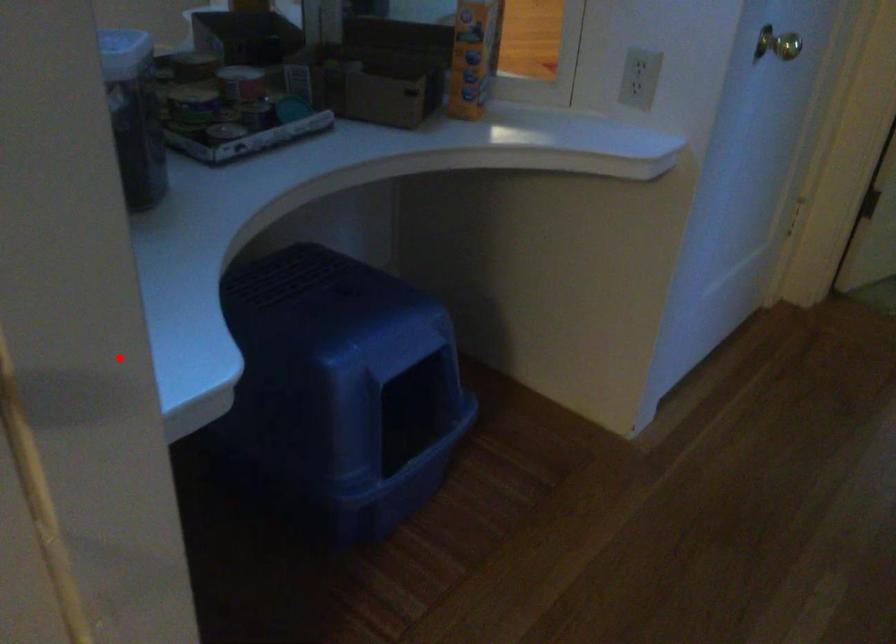
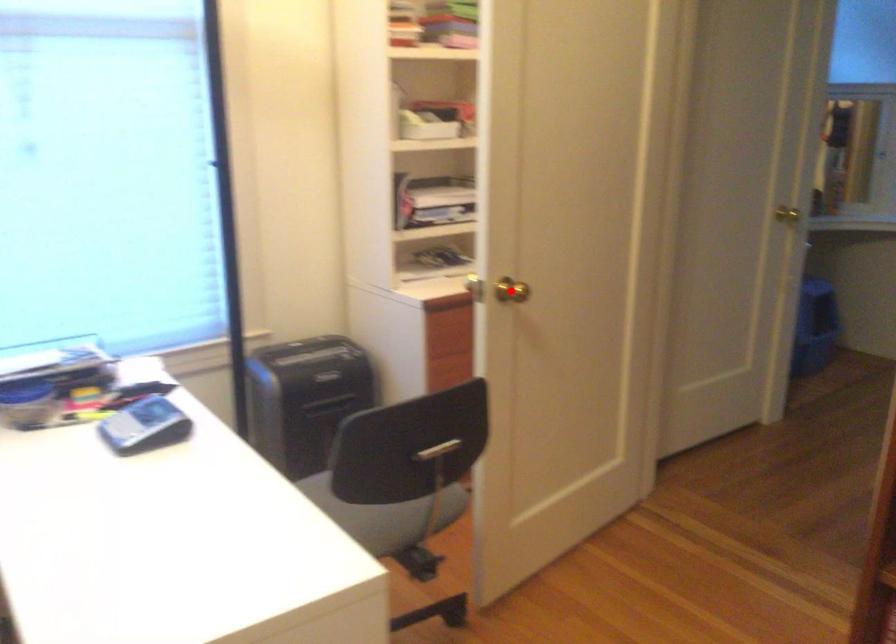
I am providing you with two images of the same scene from different viewpoints. A red point is marked on the first image and another point is marked on the second image. Are the points marked in image1 and image2 representing the same 3D position?

No